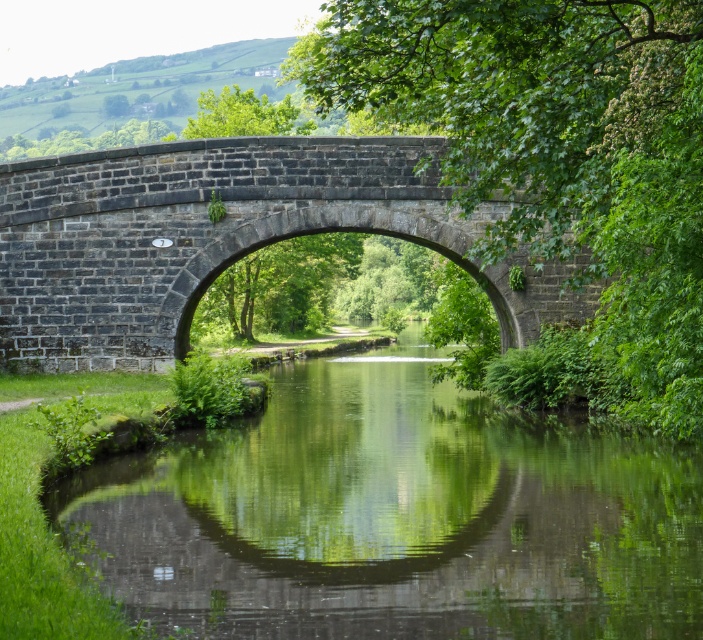
What do you see at coordinates (399, 516) in the screenshot? I see `green reflective water at center` at bounding box center [399, 516].

Does point (695, 566) lie in front of point (49, 241)?

Yes, point (695, 566) is closer to viewer.

Between point (188, 595) and point (226, 145), which one is positioned behind?

The point (226, 145) is more distant.

Identify the location of green reflective water at center. The height and width of the screenshot is (640, 703). (399, 516).